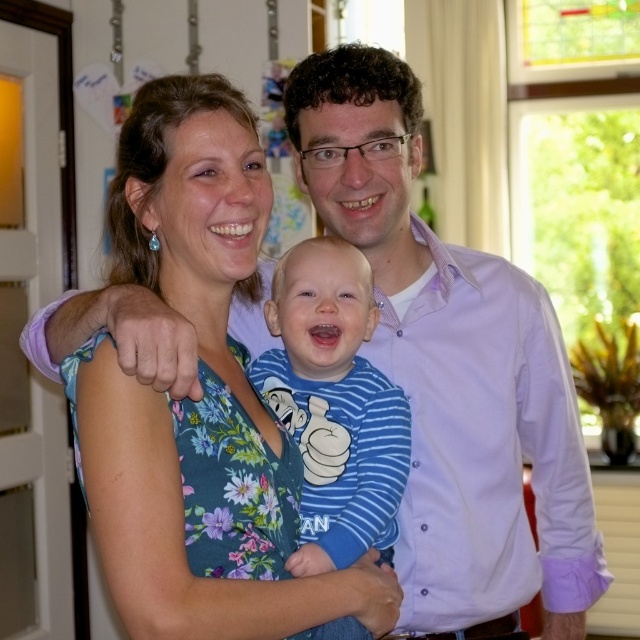
Question: Which point is closer to the camera?

Choices:
 (A) (269, 572)
 (B) (314, 408)

Answer: (A)

Question: Which point appears closest to the camera in this image?

Choices:
 (A) (372, 588)
 (B) (360, 372)

Answer: (A)

Question: Considering the relative positions of floral fabric dress at center and blue striped shirt at center in the image provided, where is floral fabric dress at center located with respect to blue striped shirt at center?

Choices:
 (A) left
 (B) right

Answer: (A)

Question: Can you confirm if floral fabric dress at center is smaller than blue striped shirt at center?

Choices:
 (A) yes
 (B) no

Answer: (B)

Question: Where is floral fabric dress at center located in relation to blue striped shirt at center in the image?

Choices:
 (A) above
 (B) below

Answer: (A)